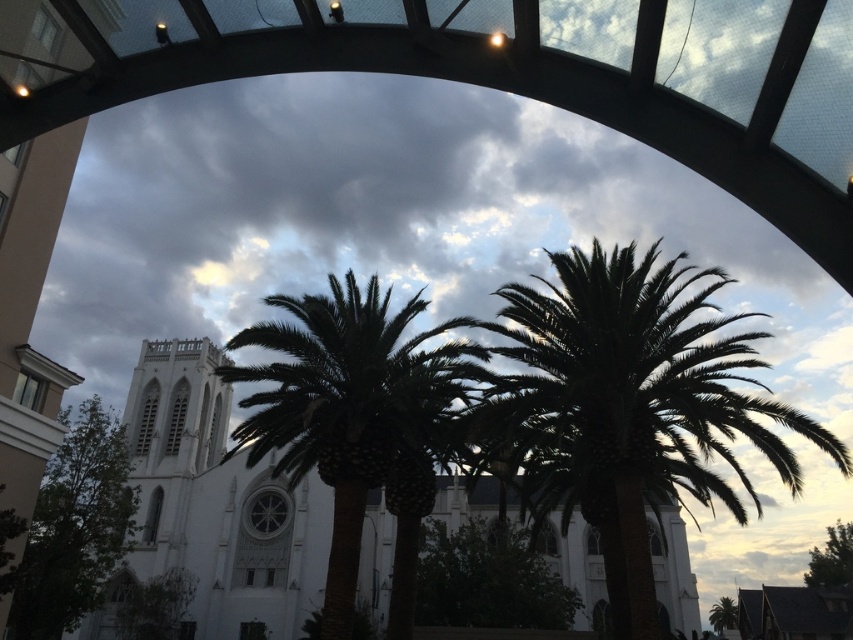
Question: Can you confirm if green leafy palm tree at center is smaller than green leafy tree at lower left?

Choices:
 (A) no
 (B) yes

Answer: (A)

Question: Which point is farther to the camera?

Choices:
 (A) green leafy tree at lower right
 (B) green leafy palm tree at center
 (C) green leafy tree at lower left

Answer: (A)

Question: Which point is closer to the camera?

Choices:
 (A) (96, 438)
 (B) (329, 636)

Answer: (B)

Question: Which point is closer to the camera?

Choices:
 (A) green leafy palm at center
 (B) green leafy tree at lower left

Answer: (B)

Question: Does green leafy palm at center appear over white smooth church at center?

Choices:
 (A) yes
 (B) no

Answer: (A)

Question: Can you confirm if green leafy palm at center is thinner than green leafy tree at center?

Choices:
 (A) yes
 (B) no

Answer: (B)